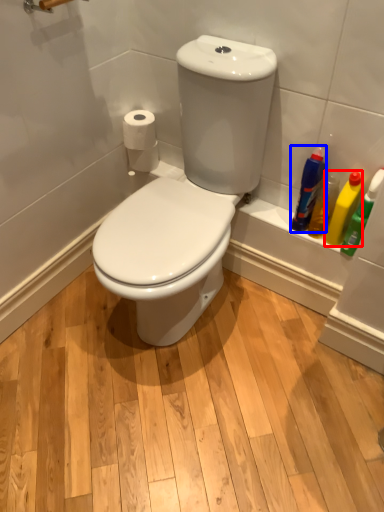
Question: Which object appears closest to the camera in this image, cleaning product (highlighted by a red box) or cleaning product (highlighted by a blue box)?

Choices:
 (A) cleaning product
 (B) cleaning product

Answer: (A)